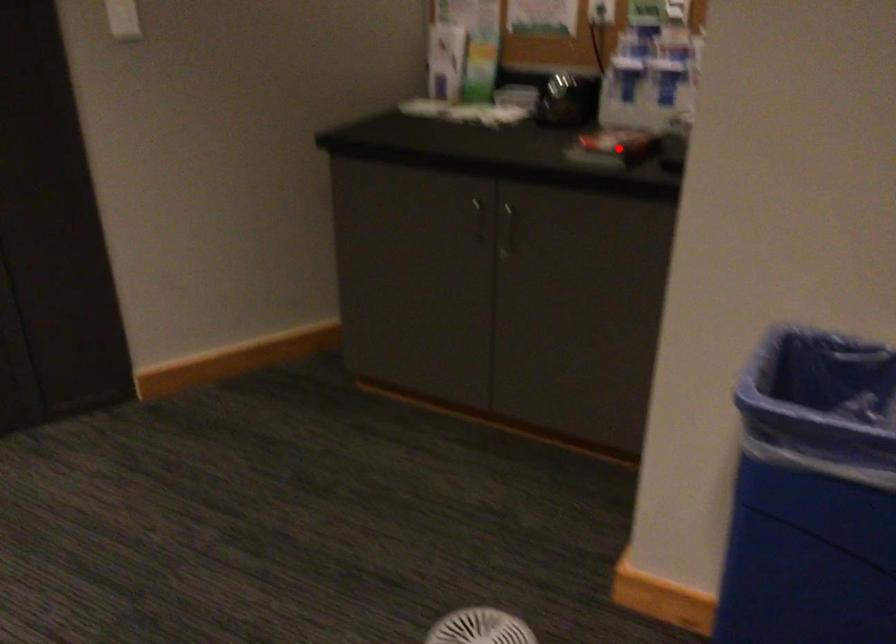
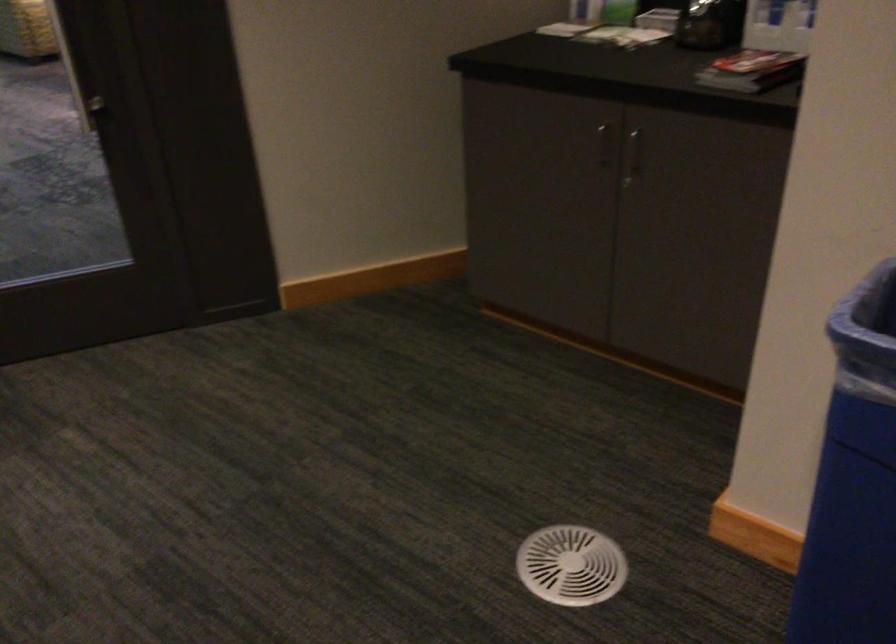
Where in the second image is the point corresponding to the highlighted location from the first image?

(751, 71)